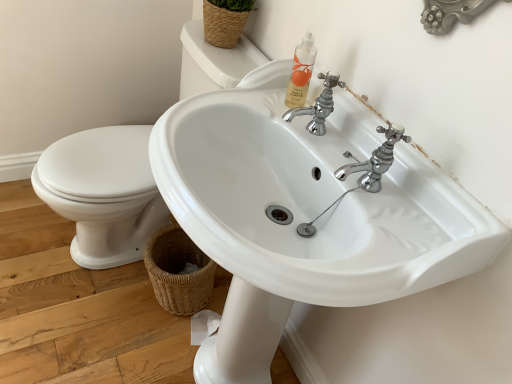
What are the coordinates of `free space in front of woven straw basket at upper center, the 2th basket in the bottom-to-top sequence` in the screenshot? It's located at (222, 65).